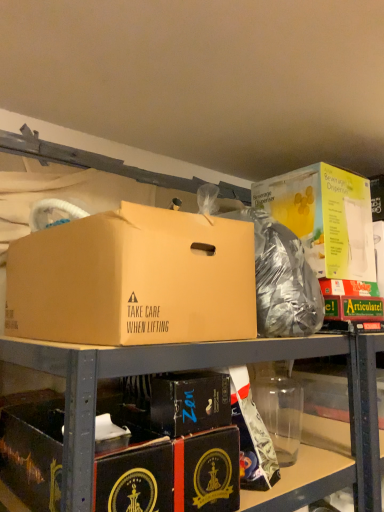
Question: Is point (279, 248) positioned closer to the camera than point (241, 329)?

Choices:
 (A) farther
 (B) closer

Answer: (A)

Question: Is shiny metallic bag at center to the left or to the right of brown cardboard box at center, positioned as the third box in bottom-to-top order, in the image?

Choices:
 (A) left
 (B) right

Answer: (B)

Question: Which object is the closest to the shiny metallic bag at center?

Choices:
 (A) black cardboard box at lower left, marked as the first box in a bottom-to-top arrangement
 (B) black cardboard box at center, which ranks as the second box in bottom-to-top order
 (C) yellow cardboard beverage dispenser at upper right, which ranks as the first box in top-to-bottom order
 (D) brown cardboard box at center, positioned as the third box in bottom-to-top order

Answer: (C)

Question: Which object is positioned closest to the brown cardboard box at center, the second box from the top?

Choices:
 (A) black cardboard box at center, acting as the third box starting from the top
 (B) yellow cardboard beverage dispenser at upper right, which ranks as the first box in top-to-bottom order
 (C) black cardboard box at lower left, which is the 4th box from top to bottom
 (D) shiny metallic bag at center

Answer: (A)